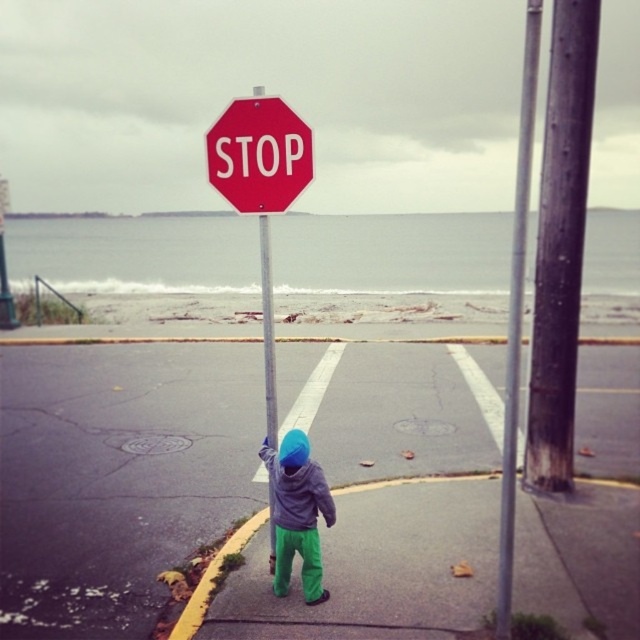
Question: Which point is closer to the camera?

Choices:
 (A) (522, 273)
 (B) (285, 368)
 (C) (228, 152)
 (D) (292, 141)

Answer: (A)

Question: Which of these objects is positioned farthest from the red matte stop sign at center?

Choices:
 (A) gray fleece hoodie at center
 (B) smooth asphalt road at center
 (C) red matte stop sign at upper center

Answer: (B)

Question: Is smooth asphalt road at center below gray fleece hoodie at center?

Choices:
 (A) yes
 (B) no

Answer: (B)

Question: Does red matte stop sign at center appear on the left side of gray fleece hoodie at center?

Choices:
 (A) no
 (B) yes

Answer: (B)

Question: Which point is closer to the camera?

Choices:
 (A) (312, 545)
 (B) (252, 122)
 (C) (524, 237)
 (D) (211, 182)

Answer: (C)

Question: Is smooth asphalt road at center positioned before red matte stop sign at center?

Choices:
 (A) no
 (B) yes

Answer: (B)